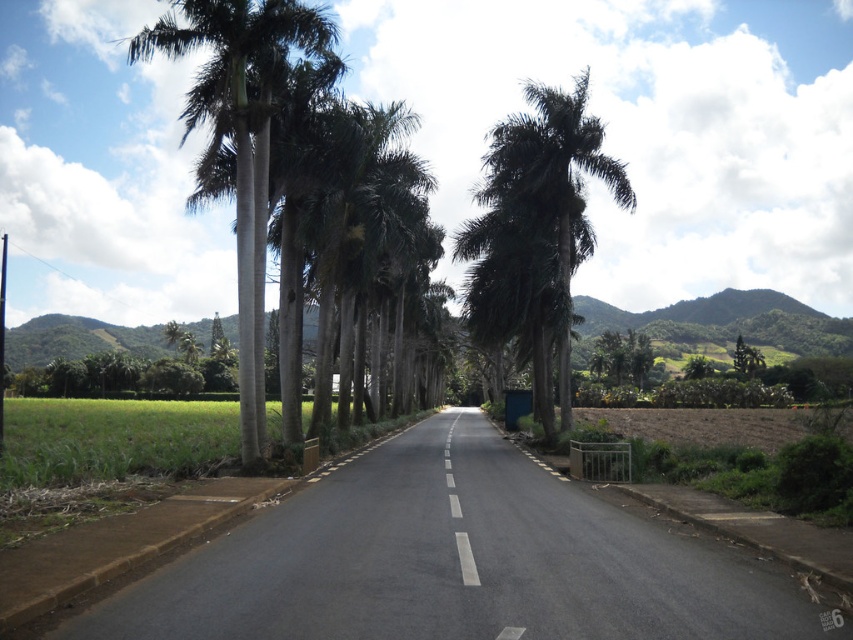
You are standing at the starting point of the road and see the point marked at coordinates (x=537, y=234). What object is located at that point?

The point at coordinates (x=537, y=234) corresponds to the green leafy palm tree at center.

You are driving a car and see the green leafy palm tree at center and the white smooth line at center ahead. Which object is higher from the ground?

The green leafy palm tree at center is above the white smooth line at center, so the palm tree is higher from the ground.

You are driving a car that is 2 meters wide. You see the green leafy palm tree at center and the white smooth line at center. Can your car pass between them without touching either?

The green leafy palm tree at center might be wider than the white smooth line at center, so there might not be enough space for the car to pass safely. Check the actual width before proceeding.